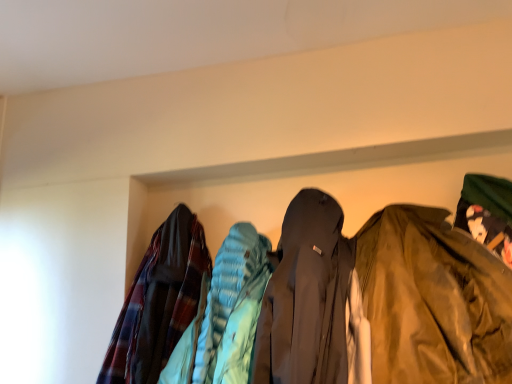
What are the coordinates of `plaid fabric jacket at left, the first jacket from the left` in the screenshot? It's located at (158, 301).

This screenshot has width=512, height=384. What do you see at coordinates (158, 301) in the screenshot?
I see `plaid fabric jacket at left, marked as the second jacket in a right-to-left arrangement` at bounding box center [158, 301].

Find the location of `shiny olive-green jacket at right, which appears as the second jacket when viewed from the left`. shiny olive-green jacket at right, which appears as the second jacket when viewed from the left is located at coordinates (433, 300).

Describe the element at coordinates (433, 300) in the screenshot. I see `shiny olive-green jacket at right, which appears as the second jacket when viewed from the left` at that location.

Locate an element on the screen. This screenshot has width=512, height=384. plaid fabric jacket at left, marked as the second jacket in a right-to-left arrangement is located at coordinates (158, 301).

Which is more to the right, plaid fabric jacket at left, marked as the second jacket in a right-to-left arrangement, or shiny olive-green jacket at right, which ranks as the 1th jacket in right-to-left order?

shiny olive-green jacket at right, which ranks as the 1th jacket in right-to-left order, is more to the right.

Who is more distant, plaid fabric jacket at left, the first jacket from the left, or shiny olive-green jacket at right, which appears as the second jacket when viewed from the left?

Positioned behind is plaid fabric jacket at left, the first jacket from the left.

Which is less distant, (145, 342) or (389, 345)?

The point (389, 345) is closer to the camera.

From the image's perspective, is plaid fabric jacket at left, marked as the second jacket in a right-to-left arrangement, located above or below shiny olive-green jacket at right, which appears as the second jacket when viewed from the left?

Clearly, from the image's perspective, plaid fabric jacket at left, marked as the second jacket in a right-to-left arrangement, is below shiny olive-green jacket at right, which appears as the second jacket when viewed from the left.

From a real-world perspective, between plaid fabric jacket at left, the first jacket from the left, and shiny olive-green jacket at right, which appears as the second jacket when viewed from the left, who is vertically lower?

From a 3D spatial view, shiny olive-green jacket at right, which appears as the second jacket when viewed from the left, is below.

Does plaid fabric jacket at left, marked as the second jacket in a right-to-left arrangement, have a lesser width compared to shiny olive-green jacket at right, which appears as the second jacket when viewed from the left?

Correct, the width of plaid fabric jacket at left, marked as the second jacket in a right-to-left arrangement, is less than that of shiny olive-green jacket at right, which appears as the second jacket when viewed from the left.

In terms of height, does plaid fabric jacket at left, the first jacket from the left, look taller or shorter compared to shiny olive-green jacket at right, which ranks as the 1th jacket in right-to-left order?

Considering their sizes, plaid fabric jacket at left, the first jacket from the left, has more height than shiny olive-green jacket at right, which ranks as the 1th jacket in right-to-left order.

Does plaid fabric jacket at left, marked as the second jacket in a right-to-left arrangement, have a smaller size compared to shiny olive-green jacket at right, which appears as the second jacket when viewed from the left?

Yes, plaid fabric jacket at left, marked as the second jacket in a right-to-left arrangement, is smaller than shiny olive-green jacket at right, which appears as the second jacket when viewed from the left.

Does plaid fabric jacket at left, the first jacket from the left, contain shiny olive-green jacket at right, which appears as the second jacket when viewed from the left?

No, shiny olive-green jacket at right, which appears as the second jacket when viewed from the left, is not a part of plaid fabric jacket at left, the first jacket from the left.

Is plaid fabric jacket at left, the first jacket from the left, far away from shiny olive-green jacket at right, which ranks as the 1th jacket in right-to-left order?

Actually, plaid fabric jacket at left, the first jacket from the left, and shiny olive-green jacket at right, which ranks as the 1th jacket in right-to-left order, are a little close together.

Is plaid fabric jacket at left, marked as the second jacket in a right-to-left arrangement, looking in the opposite direction of shiny olive-green jacket at right, which appears as the second jacket when viewed from the left?

No.

Consider the image. What's the angular difference between plaid fabric jacket at left, the first jacket from the left, and shiny olive-green jacket at right, which appears as the second jacket when viewed from the left,'s facing directions?

The angle between the facing direction of plaid fabric jacket at left, the first jacket from the left, and the facing direction of shiny olive-green jacket at right, which appears as the second jacket when viewed from the left, is 0.00077 degrees.

Measure the distance between plaid fabric jacket at left, the first jacket from the left, and shiny olive-green jacket at right, which appears as the second jacket when viewed from the left.

plaid fabric jacket at left, the first jacket from the left, is 24.95 inches away from shiny olive-green jacket at right, which appears as the second jacket when viewed from the left.

This screenshot has width=512, height=384. Identify the location of jacket that is below the shiny olive-green jacket at right, which appears as the second jacket when viewed from the left (from the image's perspective). (158, 301).

Can you confirm if shiny olive-green jacket at right, which appears as the second jacket when viewed from the left, is positioned to the left of plaid fabric jacket at left, marked as the second jacket in a right-to-left arrangement?

No.

Is shiny olive-green jacket at right, which appears as the second jacket when viewed from the left, in front of plaid fabric jacket at left, the first jacket from the left?

Yes, shiny olive-green jacket at right, which appears as the second jacket when viewed from the left, is in front of plaid fabric jacket at left, the first jacket from the left.

Looking at this image, which point is more forward, (377, 361) or (170, 238)?

Point (377, 361)

From the image's perspective, is shiny olive-green jacket at right, which ranks as the 1th jacket in right-to-left order, over plaid fabric jacket at left, the first jacket from the left?

Yes, from the image's perspective, shiny olive-green jacket at right, which ranks as the 1th jacket in right-to-left order, is over plaid fabric jacket at left, the first jacket from the left.

From a real-world perspective, between shiny olive-green jacket at right, which ranks as the 1th jacket in right-to-left order, and plaid fabric jacket at left, marked as the second jacket in a right-to-left arrangement, who is vertically lower?

shiny olive-green jacket at right, which ranks as the 1th jacket in right-to-left order, from a real-world perspective.

Between shiny olive-green jacket at right, which appears as the second jacket when viewed from the left, and plaid fabric jacket at left, the first jacket from the left, which one has smaller width?

Thinner between the two is plaid fabric jacket at left, the first jacket from the left.

Who is shorter, shiny olive-green jacket at right, which appears as the second jacket when viewed from the left, or plaid fabric jacket at left, the first jacket from the left?

shiny olive-green jacket at right, which appears as the second jacket when viewed from the left.

From the picture: Is shiny olive-green jacket at right, which ranks as the 1th jacket in right-to-left order, bigger or smaller than plaid fabric jacket at left, marked as the second jacket in a right-to-left arrangement?

Clearly, shiny olive-green jacket at right, which ranks as the 1th jacket in right-to-left order, is larger in size than plaid fabric jacket at left, marked as the second jacket in a right-to-left arrangement.

Choose the correct answer: Is shiny olive-green jacket at right, which ranks as the 1th jacket in right-to-left order, inside plaid fabric jacket at left, marked as the second jacket in a right-to-left arrangement, or outside it?

shiny olive-green jacket at right, which ranks as the 1th jacket in right-to-left order, is located beyond the bounds of plaid fabric jacket at left, marked as the second jacket in a right-to-left arrangement.

Are shiny olive-green jacket at right, which ranks as the 1th jacket in right-to-left order, and plaid fabric jacket at left, marked as the second jacket in a right-to-left arrangement, located far from each other?

No.

Is shiny olive-green jacket at right, which ranks as the 1th jacket in right-to-left order, facing away from plaid fabric jacket at left, the first jacket from the left?

That's not correct — shiny olive-green jacket at right, which ranks as the 1th jacket in right-to-left order, is not looking away from plaid fabric jacket at left, the first jacket from the left.

Can you tell me how much shiny olive-green jacket at right, which appears as the second jacket when viewed from the left, and plaid fabric jacket at left, the first jacket from the left, differ in facing direction?

There is a 0.00077-degree angle between the facing directions of shiny olive-green jacket at right, which appears as the second jacket when viewed from the left, and plaid fabric jacket at left, the first jacket from the left.

Identify the location of jacket above the shiny olive-green jacket at right, which appears as the second jacket when viewed from the left (from a real-world perspective). (158, 301).

This screenshot has height=384, width=512. In order to click on jacket on the right of plaid fabric jacket at left, the first jacket from the left in this screenshot , I will do `click(433, 300)`.

Where is `jacket directly beneath the plaid fabric jacket at left, marked as the second jacket in a right-to-left arrangement (from a real-world perspective)`? jacket directly beneath the plaid fabric jacket at left, marked as the second jacket in a right-to-left arrangement (from a real-world perspective) is located at coordinates (433, 300).